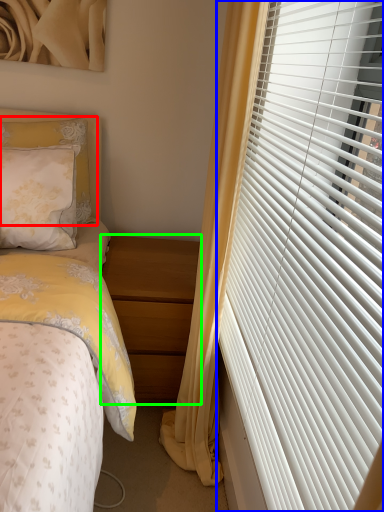
Question: Considering the real-world distances, which object is farthest from pillow (highlighted by a red box)? window blind (highlighted by a blue box) or nightstand (highlighted by a green box)?

Choices:
 (A) window blind
 (B) nightstand

Answer: (A)